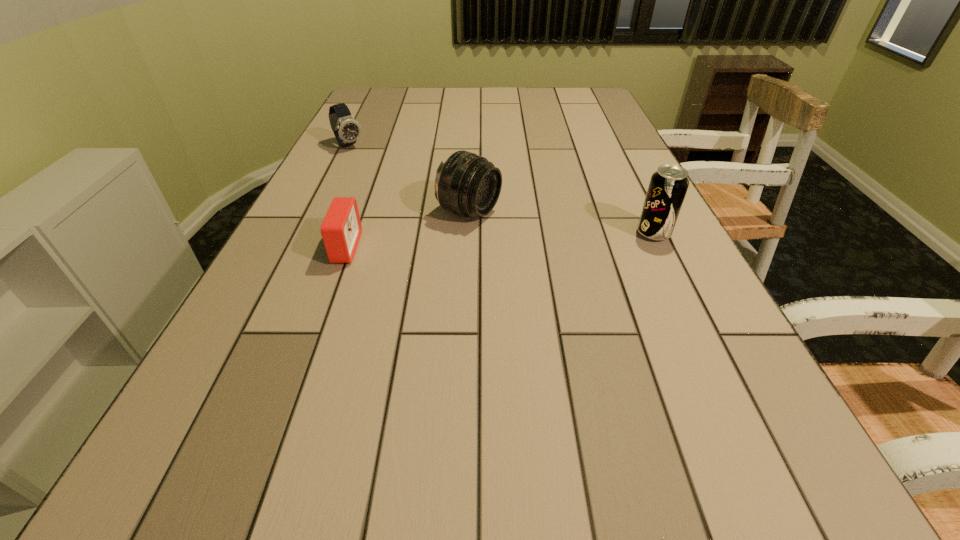
The image size is (960, 540). In order to click on the shortest object in this screenshot , I will do `click(341, 229)`.

Image resolution: width=960 pixels, height=540 pixels. In order to click on alarm clock in this screenshot , I will do (x=341, y=229).

I want to click on the rightmost object, so click(668, 186).

At what (x,y) coordinates should I click in order to perform the action: click on the leftmost object. Please return your answer as a coordinate pair (x, y). Looking at the image, I should click on (346, 129).

This screenshot has width=960, height=540. Find the location of `watch`. watch is located at coordinates (346, 129).

Locate an element on the screen. The image size is (960, 540). the second object from right to left is located at coordinates (467, 184).

Where is `vacant space located 0.060m on the front-facing side of the third object from right to left`? vacant space located 0.060m on the front-facing side of the third object from right to left is located at coordinates (386, 248).

This screenshot has width=960, height=540. In order to click on free space located on the front of the soda can in this screenshot , I will do `click(688, 305)`.

Find the location of a particular element. The height and width of the screenshot is (540, 960). free point located 0.280m on the face of the farthest object is located at coordinates (402, 192).

The height and width of the screenshot is (540, 960). Identify the location of vacant position located 0.230m on the face of the farthest object. (393, 184).